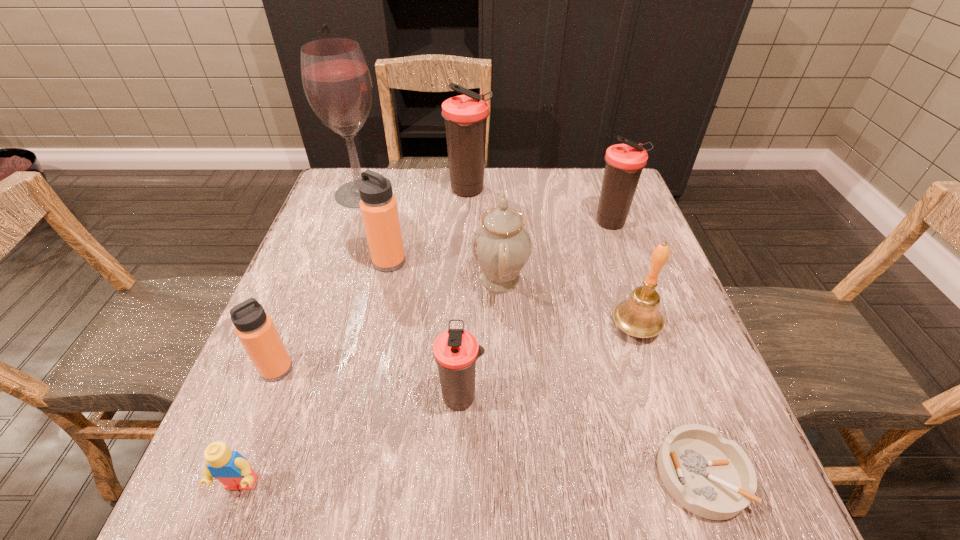
In order to click on alcohol situated at the left edge in this screenshot , I will do `click(336, 80)`.

The width and height of the screenshot is (960, 540). Identify the location of thermos bottle positioned at the left edge. coord(255,329).

At what (x,y) coordinates should I click in order to perform the action: click on Lego that is at the left edge. Please return your answer as a coordinate pair (x, y). This screenshot has width=960, height=540. Looking at the image, I should click on (234, 471).

The height and width of the screenshot is (540, 960). What are the coordinates of `thermos bottle that is at the right edge` in the screenshot? It's located at (624, 162).

Where is `bell that is at the right edge`? This screenshot has width=960, height=540. bell that is at the right edge is located at coordinates (639, 316).

Locate an element on the screen. Image resolution: width=960 pixels, height=540 pixels. ashtray present at the right edge is located at coordinates pos(710,476).

Image resolution: width=960 pixels, height=540 pixels. Find the location of `object located at the far left corner`. object located at the far left corner is located at coordinates (336, 80).

Where is `object that is at the near left corner`? Image resolution: width=960 pixels, height=540 pixels. object that is at the near left corner is located at coordinates (234, 471).

Locate an element on the screen. This screenshot has height=540, width=960. object positioned at the far right corner is located at coordinates (624, 162).

Where is `object present at the near right corner`? object present at the near right corner is located at coordinates (710, 476).